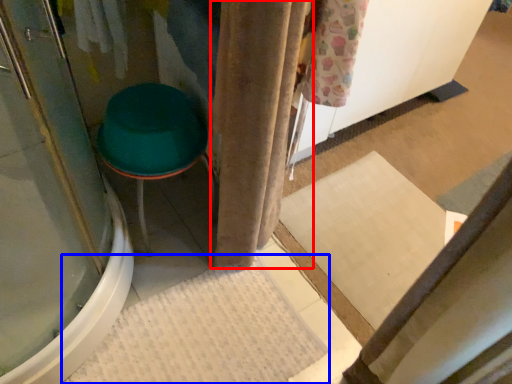
Question: Among these objects, which one is farthest to the camera, curtain (highlighted by a red box) or bath mat (highlighted by a blue box)?

Choices:
 (A) curtain
 (B) bath mat

Answer: (B)